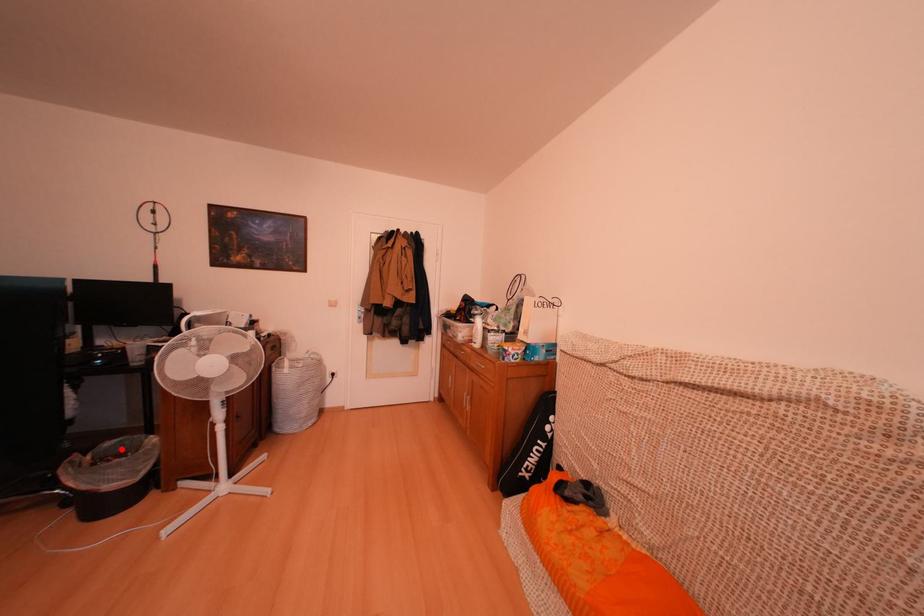
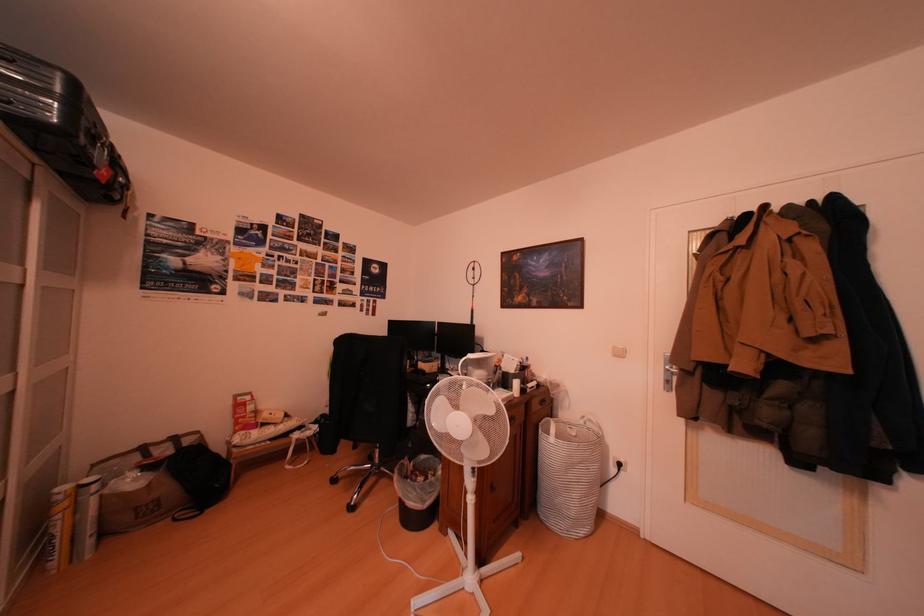
Find the pixel in the second image that matches the highlighted location in the first image.

(435, 463)